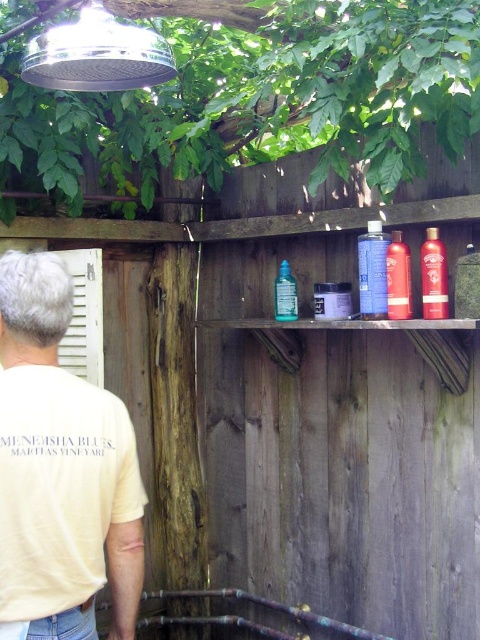
Is shiny red bottle at upper right wider than translucent glass bottle at center?

Indeed, shiny red bottle at upper right has a greater width compared to translucent glass bottle at center.

Does shiny red bottle at upper right have a greater height compared to translucent glass bottle at center?

Correct, shiny red bottle at upper right is much taller as translucent glass bottle at center.

Between point (432, 316) and point (294, 312), which one is positioned behind?

The point (294, 312) is behind.

Locate an element on the screen. shiny red bottle at upper right is located at coordinates (433, 276).

Who is higher up, blue matte spray can at upper center or red matte hair spray at upper center?

blue matte spray can at upper center

Can you confirm if blue matte spray can at upper center is thinner than red matte hair spray at upper center?

No.

Locate an element on the screen. Image resolution: width=480 pixels, height=640 pixels. blue matte spray can at upper center is located at coordinates (372, 272).

Image resolution: width=480 pixels, height=640 pixels. Describe the element at coordinates (60, 465) in the screenshot. I see `yellow cotton t-shirt at lower left` at that location.

Between point (46, 353) and point (456, 216), which one is positioned in front?

Positioned in front is point (46, 353).

Find the location of a particular element. yellow cotton t-shirt at lower left is located at coordinates (60, 465).